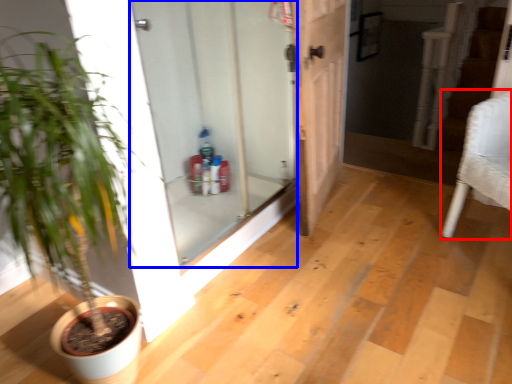
Question: Which object is further to the camera taking this photo, armchair (highlighted by a red box) or door (highlighted by a blue box)?

Choices:
 (A) armchair
 (B) door

Answer: (A)